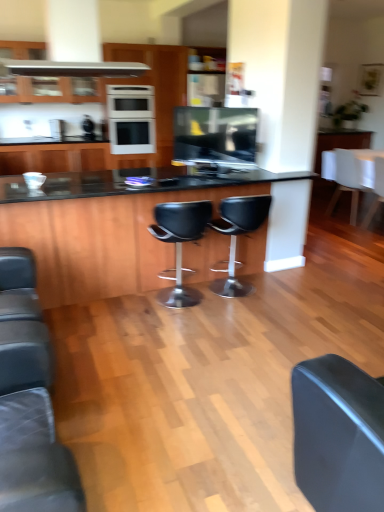
Question: Is white matte counter top at right at the left side of white glossy oven at upper center?

Choices:
 (A) no
 (B) yes

Answer: (A)

Question: From a real-world perspective, is white matte counter top at right positioned over white glossy oven at upper center based on gravity?

Choices:
 (A) yes
 (B) no

Answer: (B)

Question: Can you confirm if white matte counter top at right is wider than white glossy oven at upper center?

Choices:
 (A) no
 (B) yes

Answer: (B)

Question: From the image's perspective, is white matte counter top at right beneath white glossy oven at upper center?

Choices:
 (A) no
 (B) yes

Answer: (B)

Question: Is white matte counter top at right positioned beyond the bounds of white glossy oven at upper center?

Choices:
 (A) yes
 (B) no

Answer: (A)

Question: Would you say white fabric chair at right, arranged as the 3th chair when viewed from the front, is to the left or to the right of white matte counter top at right in the picture?

Choices:
 (A) right
 (B) left

Answer: (B)

Question: From a real-world perspective, relative to white matte counter top at right, is white fabric chair at right, which is the 4th chair from left to right, vertically above or below?

Choices:
 (A) above
 (B) below

Answer: (B)

Question: Based on their sizes in the image, would you say white fabric chair at right, which ranks as the 1th chair in right-to-left order, is bigger or smaller than white matte counter top at right?

Choices:
 (A) big
 (B) small

Answer: (B)

Question: Is white fabric chair at right, arranged as the 3th chair when viewed from the front, taller or shorter than white matte counter top at right?

Choices:
 (A) short
 (B) tall

Answer: (B)

Question: Would you say black glass table at center is inside or outside white matte counter top at right?

Choices:
 (A) outside
 (B) inside

Answer: (A)

Question: From a real-world perspective, is black glass table at center positioned above or below white matte counter top at right?

Choices:
 (A) above
 (B) below

Answer: (B)

Question: Is point (23, 217) positioned closer to the camera than point (359, 155)?

Choices:
 (A) farther
 (B) closer

Answer: (B)

Question: Based on their sizes in the image, would you say black glass table at center is bigger or smaller than white matte counter top at right?

Choices:
 (A) big
 (B) small

Answer: (A)

Question: Considering the relative positions of white matte counter top at right and black leather stool at center, placed as the third chair when sorted from back to front, in the image provided, is white matte counter top at right to the left or to the right of black leather stool at center, placed as the third chair when sorted from back to front,?

Choices:
 (A) left
 (B) right

Answer: (B)

Question: From the image's perspective, is white matte counter top at right above or below black leather stool at center, the 3th chair from the right?

Choices:
 (A) below
 (B) above

Answer: (B)